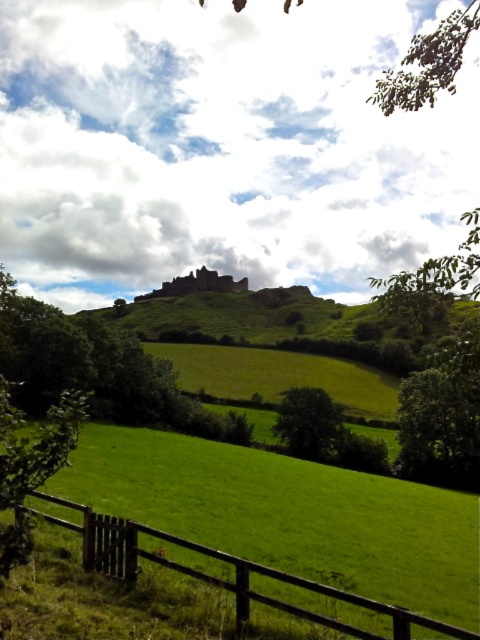
Question: Can you confirm if brown wooden fence at lower left is thinner than green leafy tree at center?

Choices:
 (A) yes
 (B) no

Answer: (B)

Question: Which point appears closest to the camera in this image?

Choices:
 (A) (314, 426)
 (B) (268, 600)

Answer: (B)

Question: Which of the following is the closest to the observer?

Choices:
 (A) (333, 433)
 (B) (103, 554)

Answer: (B)

Question: Which point is farther from the camera taking this photo?

Choices:
 (A) (64, 522)
 (B) (292, 429)

Answer: (B)

Question: Is brown wooden fence at lower left thinner than green leafy tree at center?

Choices:
 (A) yes
 (B) no

Answer: (B)

Question: Is brown wooden fence at lower left bigger than green leafy tree at center?

Choices:
 (A) yes
 (B) no

Answer: (B)